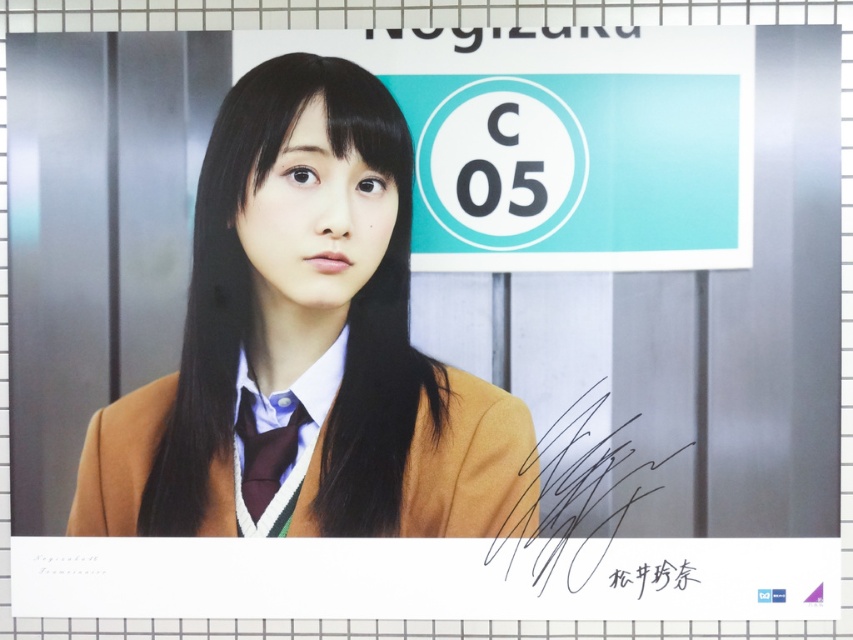
Which is more to the right, maroon satin tie at center or black ink signature at center?

black ink signature at center

Is maroon satin tie at center further to the viewer compared to black ink signature at center?

No, it is in front of black ink signature at center.

Who is more forward, (248, 504) or (688, 577)?

Point (248, 504) is in front.

What are the coordinates of `maroon satin tie at center` in the screenshot? It's located at (264, 452).

Does matte brown blazer at center have a greater width compared to maroon satin tie at center?

Correct, the width of matte brown blazer at center exceeds that of maroon satin tie at center.

This screenshot has width=853, height=640. What do you see at coordinates (409, 474) in the screenshot? I see `matte brown blazer at center` at bounding box center [409, 474].

Find the location of a particular element. Image resolution: width=853 pixels, height=640 pixels. matte brown blazer at center is located at coordinates (409, 474).

Is brown woolen sweater at center to the right of maroon satin tie at center from the viewer's perspective?

Yes, brown woolen sweater at center is to the right of maroon satin tie at center.

Is brown woolen sweater at center closer to camera compared to maroon satin tie at center?

Yes, brown woolen sweater at center is in front of maroon satin tie at center.

At what (x,y) coordinates should I click in order to perform the action: click on brown woolen sweater at center. Please return your answer as a coordinate pair (x, y). This screenshot has width=853, height=640. Looking at the image, I should click on (305, 342).

Identify the location of brown woolen sweater at center. (305, 342).